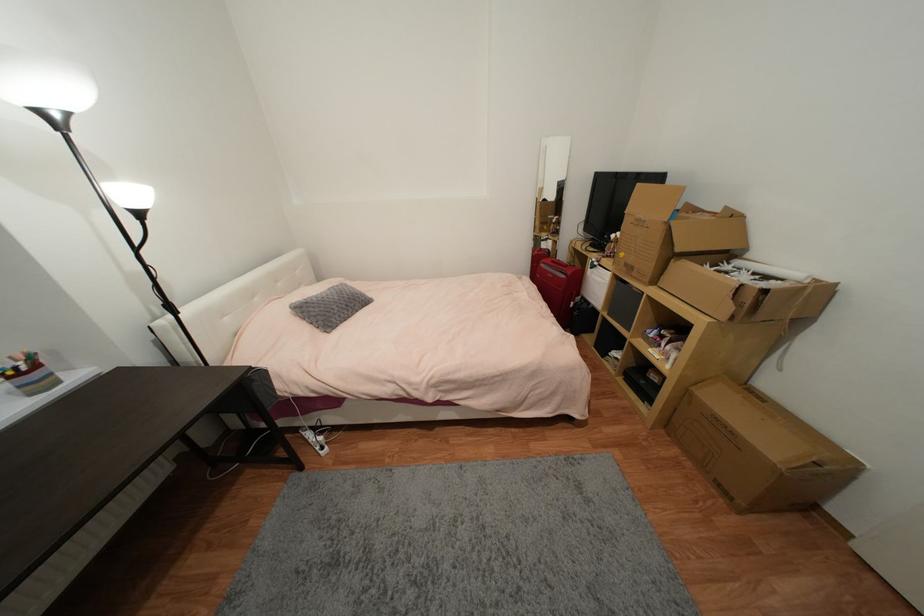
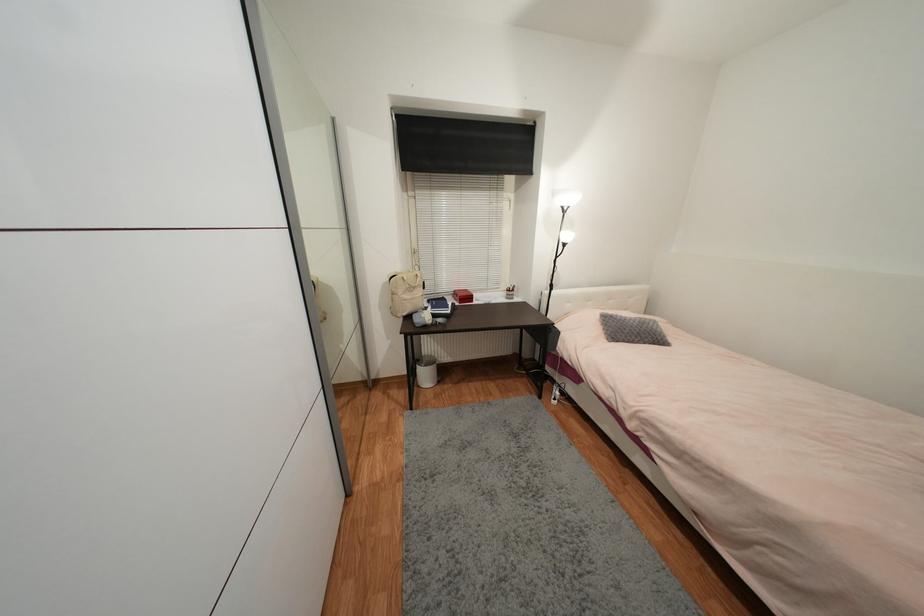
Locate, in the second image, the point that corresponds to (x=341, y=299) in the first image.

(639, 326)